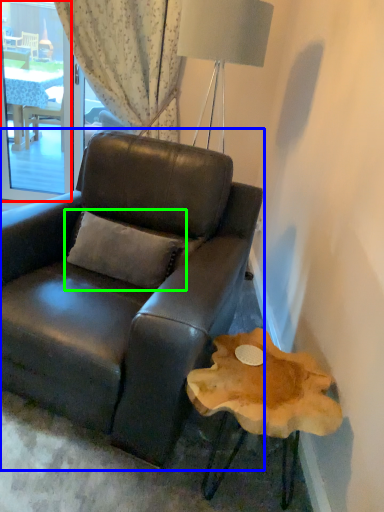
Question: Estimate the real-world distances between objects in this image. Which object is farther from window screen (highlighted by a red box), chair (highlighted by a blue box) or pillow (highlighted by a green box)?

Choices:
 (A) chair
 (B) pillow

Answer: (B)